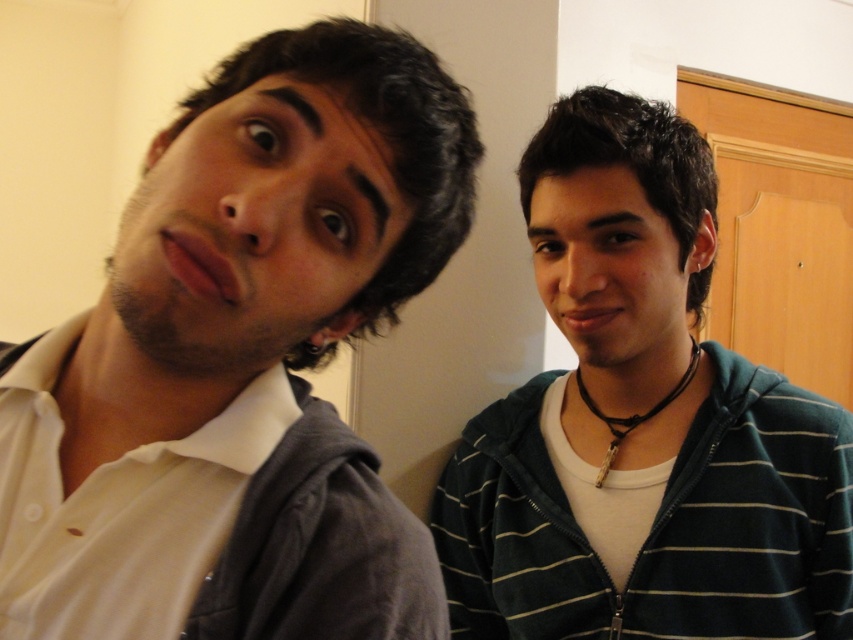
You are a GUI agent. You are given a task and a screenshot of the screen. Output one action in this format:
    pyautogui.click(x=<x>, y=<y>)
    Task: Click on the white matte shirt at left
    This screenshot has height=640, width=853.
    Given the screenshot: What is the action you would take?
    pyautogui.click(x=241, y=362)

Does white matte shirt at left appear on the left side of striped hoodie at right?

Indeed, white matte shirt at left is positioned on the left side of striped hoodie at right.

Is point (54, 368) positioned in front of point (740, 445)?

Yes.

Image resolution: width=853 pixels, height=640 pixels. I want to click on white matte shirt at left, so click(241, 362).